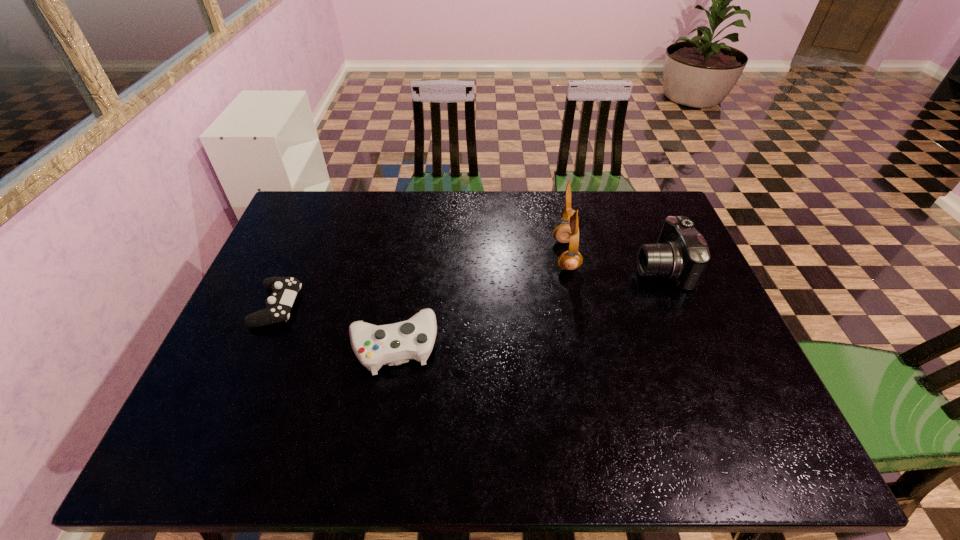
Where is `free area in between the rightmost object and the shortest object`? The width and height of the screenshot is (960, 540). free area in between the rightmost object and the shortest object is located at coordinates (469, 287).

You are a GUI agent. You are given a task and a screenshot of the screen. Output one action in this format:
    pyautogui.click(x=<x>, y=<y>)
    Task: Click on the free space between the shortest object and the earphone
    
    Given the screenshot: What is the action you would take?
    pyautogui.click(x=421, y=280)

You are a GUI agent. You are given a task and a screenshot of the screen. Output one action in this format:
    pyautogui.click(x=<x>, y=<y>)
    Task: Click on the vacant region between the right control and the rightmost object
    The width and height of the screenshot is (960, 540).
    Given the screenshot: What is the action you would take?
    pyautogui.click(x=527, y=307)

Identify which object is the third nearest to the second tallest object. Please provide its 2D coordinates. Your answer should be formatted as a tuple, i.e. [(x, y)], where the tuple contains the x and y coordinates of a point satisfying the conditions above.

[(285, 289)]

At what (x,y) coordinates should I click in order to perform the action: click on the second closest object to the right control. Please return your answer as a coordinate pair (x, y). Looking at the image, I should click on (568, 231).

At what (x,y) coordinates should I click in order to perform the action: click on free location that satisfies the following two spatial constraints: 1. on the front-facing side of the earphone; 2. on the front side of the right control. Please return your answer as a coordinate pair (x, y). This screenshot has height=540, width=960. Looking at the image, I should click on click(585, 346).

Where is `free space that satisfies the following two spatial constraints: 1. on the surface of the third object from right to left; 2. on the left side of the shortest object`? free space that satisfies the following two spatial constraints: 1. on the surface of the third object from right to left; 2. on the left side of the shortest object is located at coordinates (260, 346).

Locate an element on the screen. This screenshot has height=540, width=960. vacant position in the image that satisfies the following two spatial constraints: 1. on the lens of the second tallest object; 2. on the front side of the taller control is located at coordinates (694, 346).

Identify the location of free point that satisfies the following two spatial constraints: 1. on the lens of the rightmost object; 2. on the front side of the right control. The image size is (960, 540). (694, 346).